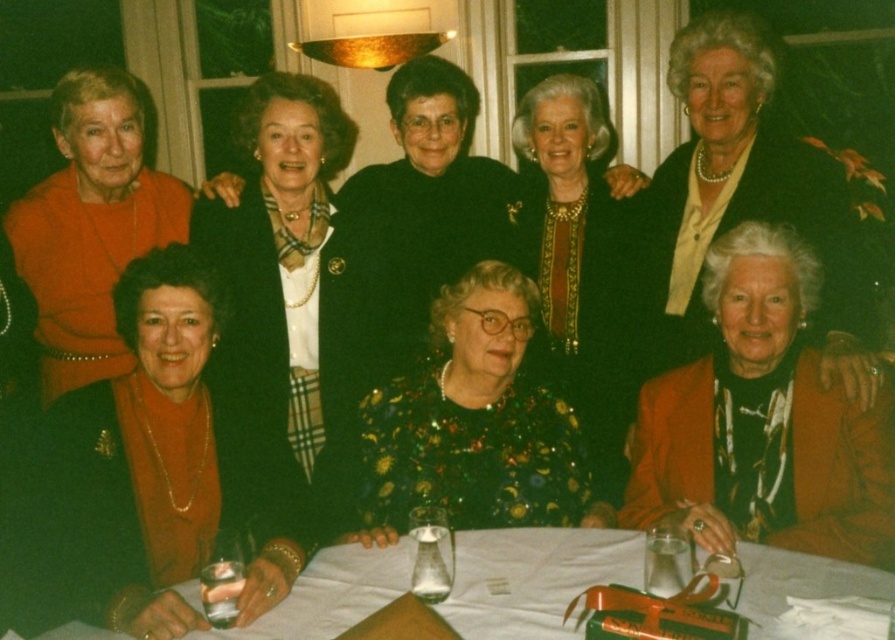
You are a photographer standing at the camera position. You need to capture a closeup shot of the matte black jacket at lower right. Considering your current position, do you think you can get a clear closeup without moving closer than 7 feet?

The distance between the matte black jacket at lower right and the camera is 7.04 feet, so yes, you can capture a clear closeup without moving closer than 7 feet since the jacket is slightly farther away than 7 feet.

You are a photographer at a formal event. You need to place a small microphone stand at point (145,476). The microphone stand will occupy the space currently taken by the matte orange sweater at lower left. Will the matte orange sweater at lower left still be visible after placing the microphone stand?

The matte orange sweater at lower left is located at point (145,476). Since the microphone stand will be placed at the same coordinates, it will cover the area where the sweater is, making the matte orange sweater at lower left no longer visible.

You are a photographer at a formal event. You need to capture a photo of the matte black jacket at lower right and the matte orange dress at lower left. Based on their positions, which one is closer to the camera?

The matte black jacket at lower right is closer to the camera because it is in front of the matte orange dress at lower left.